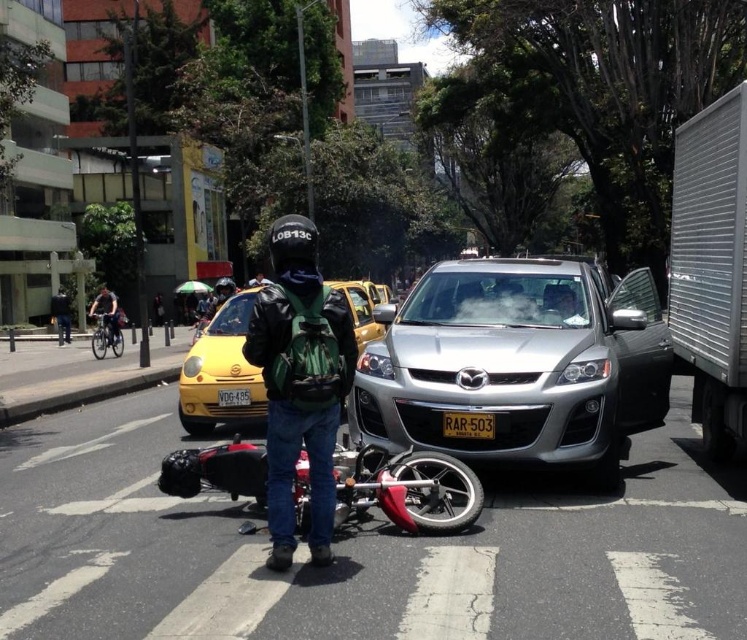
Who is lower down, silver metallic suv at center or yellow plastic license plate at center?

yellow plastic license plate at center is below.

What do you see at coordinates (518, 364) in the screenshot? Image resolution: width=747 pixels, height=640 pixels. I see `silver metallic suv at center` at bounding box center [518, 364].

Who is more forward, (607,422) or (486,433)?

Point (486,433)

Find the location of a particular element. silver metallic suv at center is located at coordinates click(x=518, y=364).

Looking at this image, which is more to the left, yellow matte taxi at center or green fabric helmet at upper center?

From the viewer's perspective, green fabric helmet at upper center appears more on the left side.

The width and height of the screenshot is (747, 640). I want to click on yellow matte taxi at center, so click(220, 371).

Does yellow matte taxi at center have a smaller size compared to shiny black motorcycle at center?

No, yellow matte taxi at center is not smaller than shiny black motorcycle at center.

In the scene shown: Does yellow matte taxi at center appear under shiny black motorcycle at center?

Actually, yellow matte taxi at center is above shiny black motorcycle at center.

I want to click on yellow matte taxi at center, so click(220, 371).